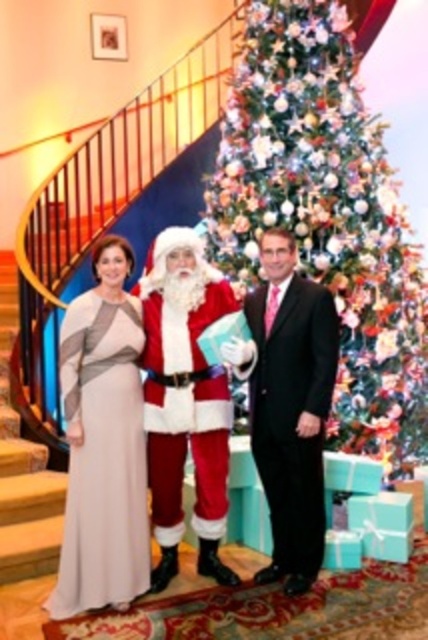
Can you confirm if fuzzy red santa at center is positioned below wooden stairs at left?

Incorrect, fuzzy red santa at center is not positioned below wooden stairs at left.

Which is below, fuzzy red santa at center or wooden stairs at left?

wooden stairs at left is below.

Does point (160, 518) come behind point (11, 490)?

That is False.

Locate an element on the screen. The height and width of the screenshot is (640, 428). fuzzy red santa at center is located at coordinates (184, 400).

Is shiny tinsel tree at center bigger than fuzzy red santa at center?

Yes, shiny tinsel tree at center is bigger than fuzzy red santa at center.

At what (x,y) coordinates should I click in order to perform the action: click on shiny tinsel tree at center. Please return your answer as a coordinate pair (x, y). This screenshot has height=640, width=428. Looking at the image, I should click on (326, 216).

Between point (193, 262) and point (330, 378), which one is positioned behind?

Point (193, 262)

You are a GUI agent. You are given a task and a screenshot of the screen. Output one action in this format:
    pyautogui.click(x=<x>, y=<y>)
    Task: Click on the fuzzy red santa at center
    The height and width of the screenshot is (640, 428).
    Given the screenshot: What is the action you would take?
    pyautogui.click(x=184, y=400)

What do you see at coordinates (184, 400) in the screenshot?
I see `fuzzy red santa at center` at bounding box center [184, 400].

You are a GUI agent. You are given a task and a screenshot of the screen. Output one action in this format:
    pyautogui.click(x=<x>, y=<y>)
    Task: Click on the fuzzy red santa at center
    This screenshot has height=640, width=428.
    Given the screenshot: What is the action you would take?
    pyautogui.click(x=184, y=400)